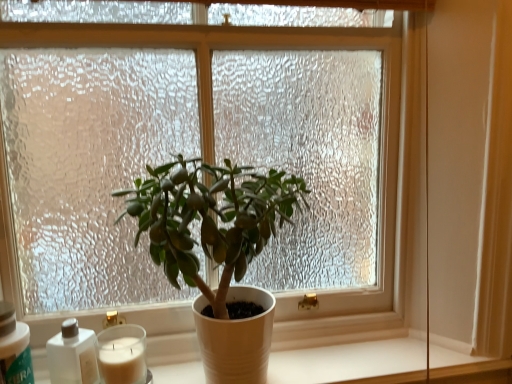
What are the coordinates of `free spot above white matte pot at center (from a real-world perspective)` in the screenshot? It's located at (335, 361).